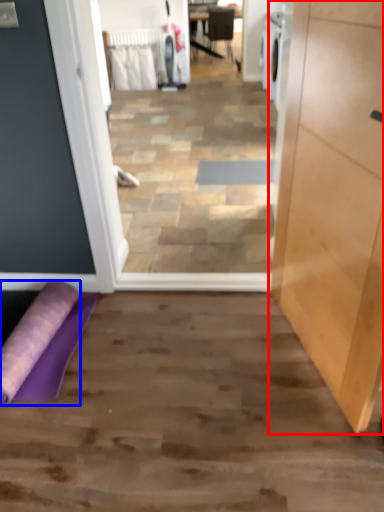
Question: Among these objects, which one is nearest to the camera, cabinetry (highlighted by a red box) or beach towel (highlighted by a blue box)?

Choices:
 (A) cabinetry
 (B) beach towel

Answer: (A)